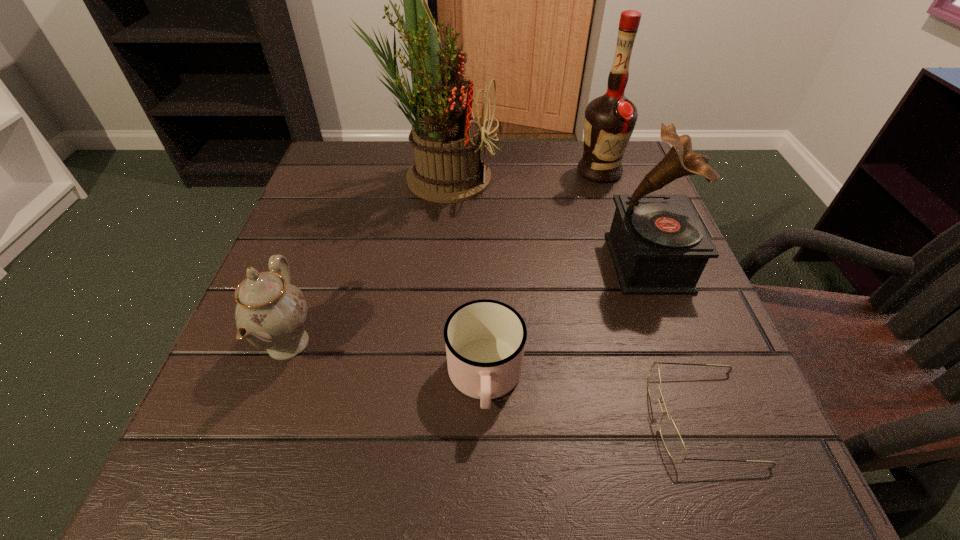
The image size is (960, 540). I want to click on free space between the leftmost object and the tallest object, so click(364, 260).

Image resolution: width=960 pixels, height=540 pixels. I want to click on vacant space that's between the second shortest object and the phonograph_record, so click(x=566, y=321).

Locate an element on the screen. This screenshot has width=960, height=540. object that is the fourth nearest to the fifth tallest object is located at coordinates (446, 139).

Locate which object ranks fifth in proximity to the phonograph_record. Please provide its 2D coordinates. Your answer should be formatted as a tuple, i.e. [(x, y)], where the tuple contains the x and y coordinates of a point satisfying the conditions above.

[(270, 313)]

This screenshot has width=960, height=540. I want to click on free space in the image that satisfies the following two spatial constraints: 1. on the front and back of the liquor; 2. on the spout of the leftmost object, so click(x=657, y=344).

Image resolution: width=960 pixels, height=540 pixels. I want to click on vacant space that satisfies the following two spatial constraints: 1. on the front and back of the second tallest object; 2. in front of the tallest object with the fan visible, so click(600, 177).